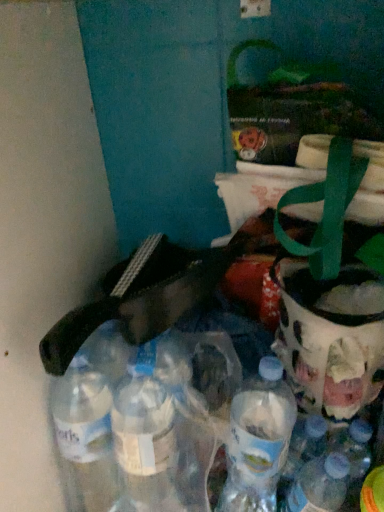
Question: Should I look upward or downward to see translucent plastic bottle at lower right, the first bottle when ordered from right to left?

Choices:
 (A) down
 (B) up

Answer: (A)

Question: From a real-world perspective, is translucent glass jar at right below translucent plastic bottle at lower right, which ranks as the 2th bottle in left-to-right order?

Choices:
 (A) no
 (B) yes

Answer: (A)

Question: Is the depth of translucent glass jar at right less than that of translucent plastic bottle at lower right, which ranks as the 2th bottle in left-to-right order?

Choices:
 (A) no
 (B) yes

Answer: (A)

Question: Is translucent plastic bottle at lower right, which ranks as the 2th bottle in left-to-right order, located within translucent glass jar at right?

Choices:
 (A) yes
 (B) no

Answer: (B)

Question: From the image's perspective, would you say translucent glass jar at right is positioned over translucent plastic bottle at lower right, which ranks as the 2th bottle in left-to-right order?

Choices:
 (A) no
 (B) yes

Answer: (B)

Question: From a real-world perspective, is translucent glass jar at right over translucent plastic bottle at lower right, the first bottle when ordered from right to left?

Choices:
 (A) yes
 (B) no

Answer: (A)

Question: Considering the relative sizes of translucent glass jar at right and translucent plastic bottle at lower right, which ranks as the 2th bottle in left-to-right order, in the image provided, is translucent glass jar at right thinner than translucent plastic bottle at lower right, which ranks as the 2th bottle in left-to-right order,?

Choices:
 (A) yes
 (B) no

Answer: (B)

Question: Can you confirm if translucent plastic bottle at lower right, which ranks as the 2th bottle in left-to-right order, is positioned to the right of translucent glass jar at right?

Choices:
 (A) yes
 (B) no

Answer: (B)

Question: Is translucent plastic bottle at lower right, the first bottle when ordered from right to left, taller than translucent glass jar at right?

Choices:
 (A) no
 (B) yes

Answer: (B)

Question: Is translucent plastic bottle at lower right, which ranks as the 2th bottle in left-to-right order, at the left side of translucent glass jar at right?

Choices:
 (A) yes
 (B) no

Answer: (A)

Question: Does translucent plastic bottle at lower right, the first bottle when ordered from right to left, have a lesser width compared to translucent glass jar at right?

Choices:
 (A) yes
 (B) no

Answer: (A)

Question: Is translucent plastic bottle at lower right, which ranks as the 2th bottle in left-to-right order, shorter than translucent glass jar at right?

Choices:
 (A) yes
 (B) no

Answer: (B)

Question: Considering the relative sizes of translucent plastic bottle at lower right, the first bottle when ordered from right to left, and translucent glass jar at right in the image provided, is translucent plastic bottle at lower right, the first bottle when ordered from right to left, bigger than translucent glass jar at right?

Choices:
 (A) yes
 (B) no

Answer: (B)

Question: From the image's perspective, is clear plastic bottles at lower left, the first bottle from the left, on top of translucent plastic bottle at lower right, the first bottle when ordered from right to left?

Choices:
 (A) yes
 (B) no

Answer: (A)